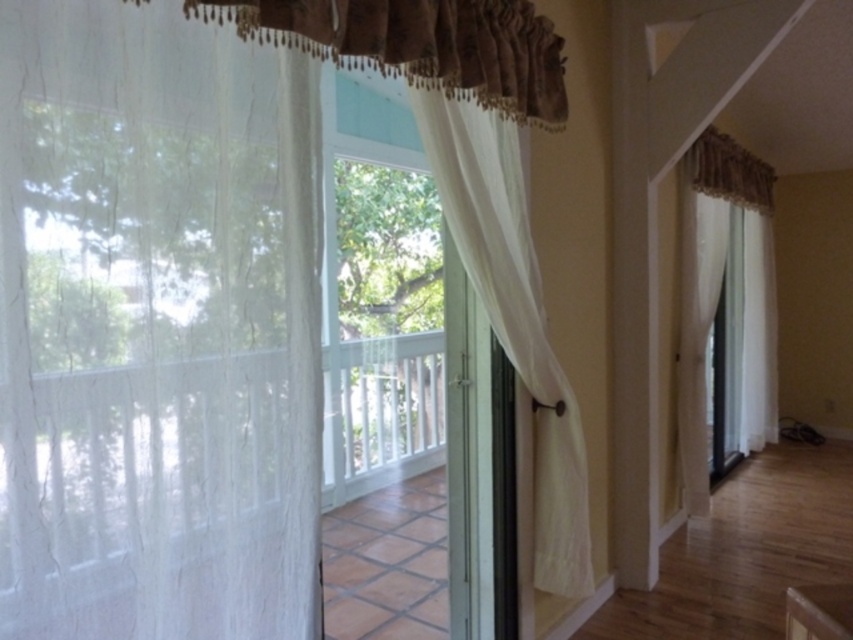
Does white sheer curtain at center appear on the right side of white sheer curtain at right?

No, white sheer curtain at center is not to the right of white sheer curtain at right.

Can you confirm if white sheer curtain at center is taller than white sheer curtain at right?

No.

Is point (518, 212) in front of point (691, 452)?

Yes, it is in front of point (691, 452).

The height and width of the screenshot is (640, 853). What are the coordinates of `white sheer curtain at center` in the screenshot? It's located at (514, 316).

Locate an element on the screen. white sheer curtain at left is located at coordinates (155, 326).

Is white sheer curtain at left thinner than white sheer curtain at right?

Indeed, white sheer curtain at left has a lesser width compared to white sheer curtain at right.

Is point (238, 598) farther from camera compared to point (695, 448)?

No, (238, 598) is closer to viewer.

Locate an element on the screen. white sheer curtain at left is located at coordinates (155, 326).

Who is shorter, white sheer curtain at left or white sheer curtain at center?

Standing shorter between the two is white sheer curtain at left.

Which is in front, point (218, 237) or point (480, 209)?

Point (218, 237) is in front.

Where is `white sheer curtain at left`? Image resolution: width=853 pixels, height=640 pixels. white sheer curtain at left is located at coordinates (155, 326).